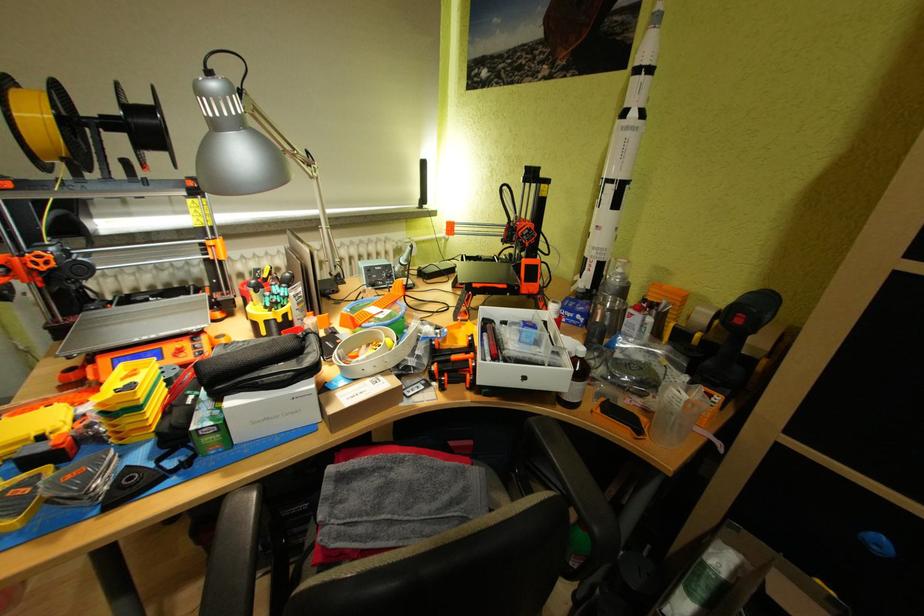
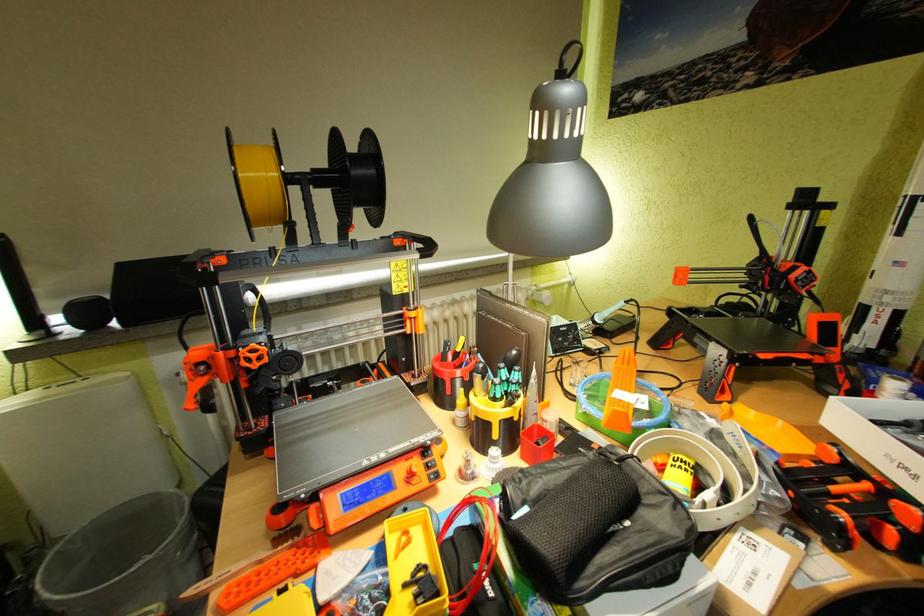
Question: The camera is either moving clockwise (left) or counter-clockwise (right) around the object. The first image is from the beginning of the video and the second image is from the end. Is the camera moving left or right when shooting the video?

Choices:
 (A) Left
 (B) Right

Answer: (B)